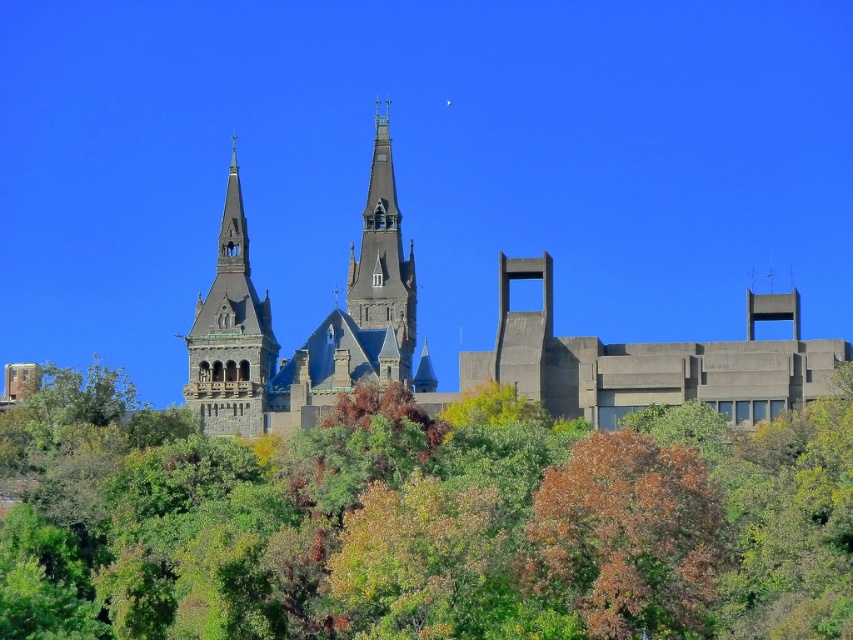
What object is located at the coordinates point (426, 524) in the image?

The point (426, 524) indicates a green leafy tree at center.

You are an architect analyzing the scene. You need to determine which object is shorter between the green leafy tree at center and the smooth gray stone tower at center. Which one is shorter?

The green leafy tree at center is shorter than the smooth gray stone tower at center.

Consider the image. You are standing at the base of the brown leafy tree at lower center and want to walk towards the smooth gray stone tower at center. Is the tower directly above your current position?

Yes, the smooth gray stone tower at center is directly above the brown leafy tree at lower center, so walking straight ahead from the tree will lead you directly underneath the tower.